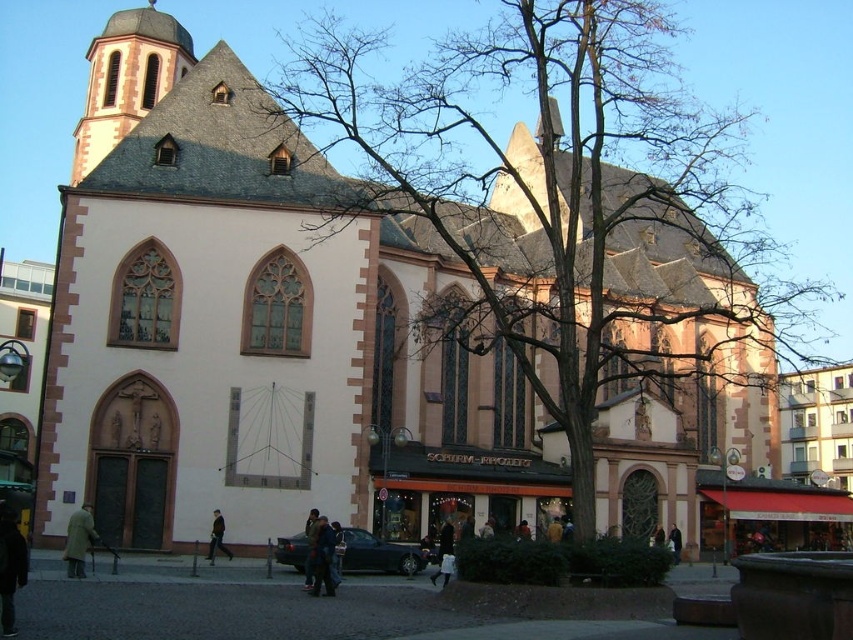
Looking at this image, does smooth stone tower at upper left have a larger size compared to dark brown leather jacket at lower left?

Yes, smooth stone tower at upper left is bigger than dark brown leather jacket at lower left.

How much distance is there between smooth stone tower at upper left and dark brown leather jacket at lower left?

smooth stone tower at upper left and dark brown leather jacket at lower left are 37.67 meters apart.

At what (x,y) coordinates should I click in order to perform the action: click on smooth stone tower at upper left. Please return your answer as a coordinate pair (x, y). Looking at the image, I should click on click(x=126, y=77).

Based on the photo, can you confirm if bare branches at center is positioned below brown leather coat at lower left?

No.

Is point (524, 86) in front of point (71, 534)?

No, (524, 86) is further to viewer.

Is point (413, 192) positioned in front of point (80, 556)?

No, (413, 192) is further to viewer.

At what (x,y) coordinates should I click in order to perform the action: click on bare branches at center. Please return your answer as a coordinate pair (x, y). The width and height of the screenshot is (853, 640). Looking at the image, I should click on (567, 208).

Is bare branches at center closer to camera compared to dark brown leather jacket at lower left?

Yes, it is in front of dark brown leather jacket at lower left.

Does point (527, 266) come in front of point (215, 516)?

No.

The height and width of the screenshot is (640, 853). I want to click on bare branches at center, so click(567, 208).